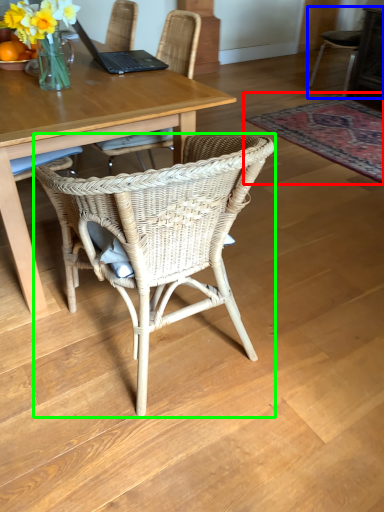
Question: Which object is positioned farthest from mat (highlighted by a red box)? Select from chair (highlighted by a blue box) and chair (highlighted by a green box).

Choices:
 (A) chair
 (B) chair

Answer: (B)